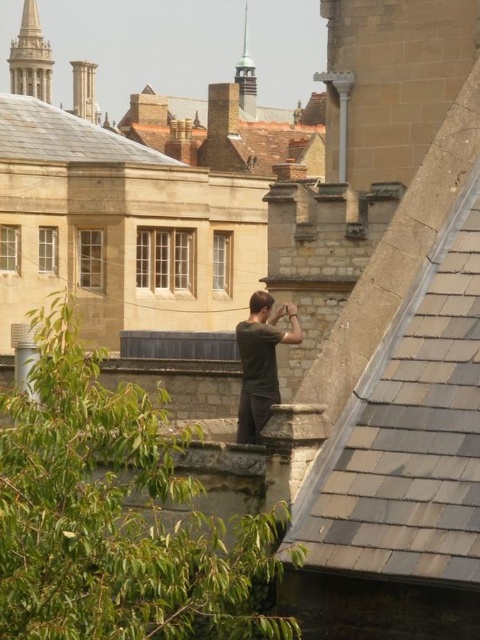
You are standing at the point with coordinates point [249,61] and want to walk towards the point with coordinates point [400,316]. Is the point you want to walk to closer to the edge of the rooftop compared to your current position?

Point [400,316] is in front of point [249,61], so yes, it is closer to the edge of the rooftop than your current position.

You are a photographer trying to capture the green patina spire at upper center in your shot. However, there is a dark gray shirt at center blocking your view. Can you adjust your position to see the spire without the obstruction?

The dark gray shirt at center is below the green patina spire at upper center, so you can move your camera angle upwards to capture the spire without the obstruction.